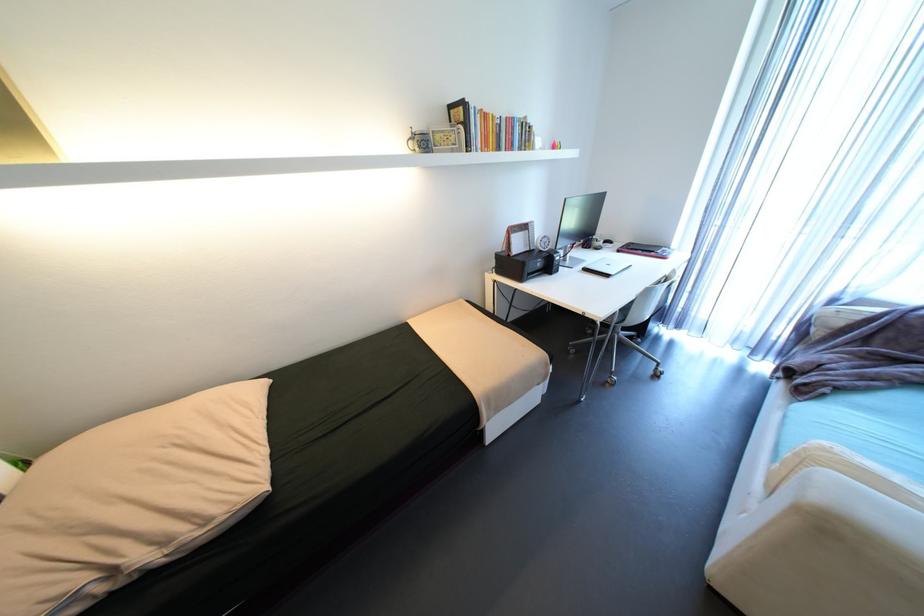
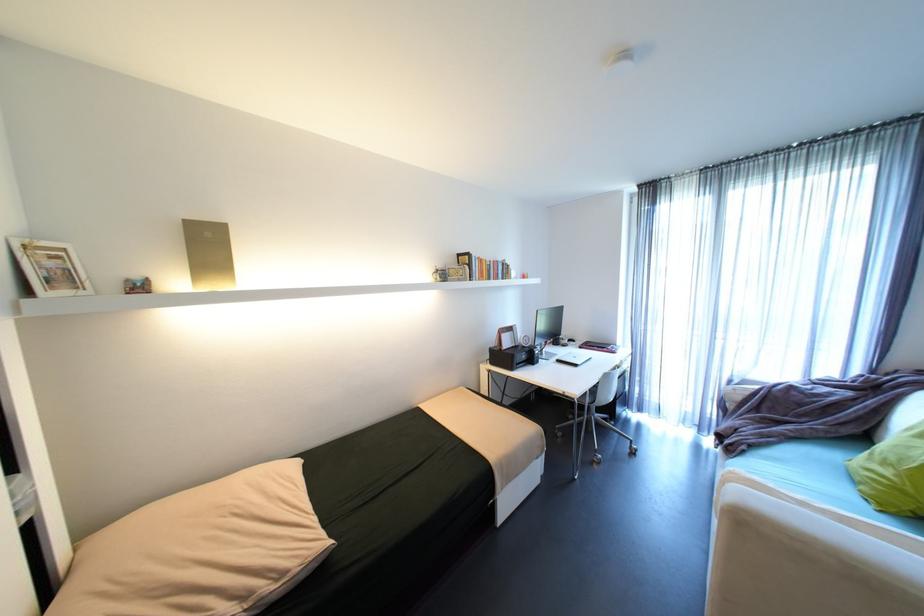
Locate, in the second image, the point that corresponds to the point at 628,246 in the first image.

(589, 344)